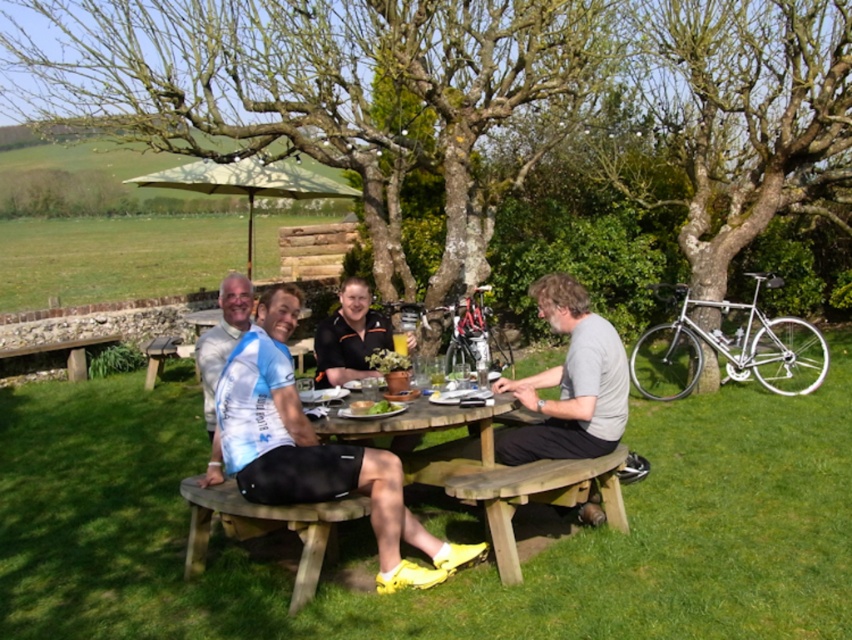
Who is lower down, blue and white cycling jersey at center or black leather bench at lower center?

black leather bench at lower center

Measure the distance from blue and white cycling jersey at center to black leather bench at lower center.

blue and white cycling jersey at center and black leather bench at lower center are 13.85 inches apart.

Is point (301, 502) positioned behind point (194, 550)?

That is False.

Identify the location of blue and white cycling jersey at center. The height and width of the screenshot is (640, 852). (312, 451).

Is black leather bench at lower center above light blue jersey at center?

Actually, black leather bench at lower center is below light blue jersey at center.

Can you confirm if black leather bench at lower center is positioned to the right of light blue jersey at center?

Yes, black leather bench at lower center is to the right of light blue jersey at center.

Where is `black leather bench at lower center`? This screenshot has height=640, width=852. black leather bench at lower center is located at coordinates (266, 528).

Where is `black leather bench at lower center`? The width and height of the screenshot is (852, 640). black leather bench at lower center is located at coordinates (266, 528).

Based on the photo, is black leather bench at lower center above green fabric umbrella at center?

No, black leather bench at lower center is not above green fabric umbrella at center.

Locate an element on the screen. The image size is (852, 640). black leather bench at lower center is located at coordinates (266, 528).